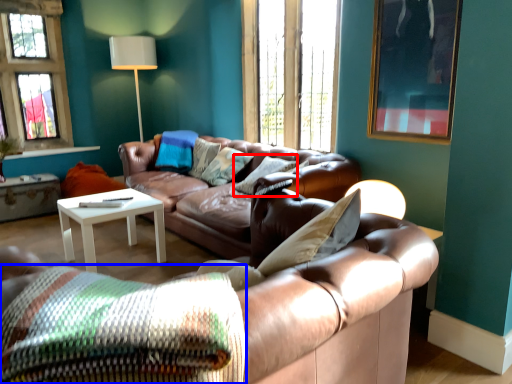
Question: Among these objects, which one is nearest to the camera, pillow (highlighted by a red box) or pillow (highlighted by a blue box)?

Choices:
 (A) pillow
 (B) pillow

Answer: (B)